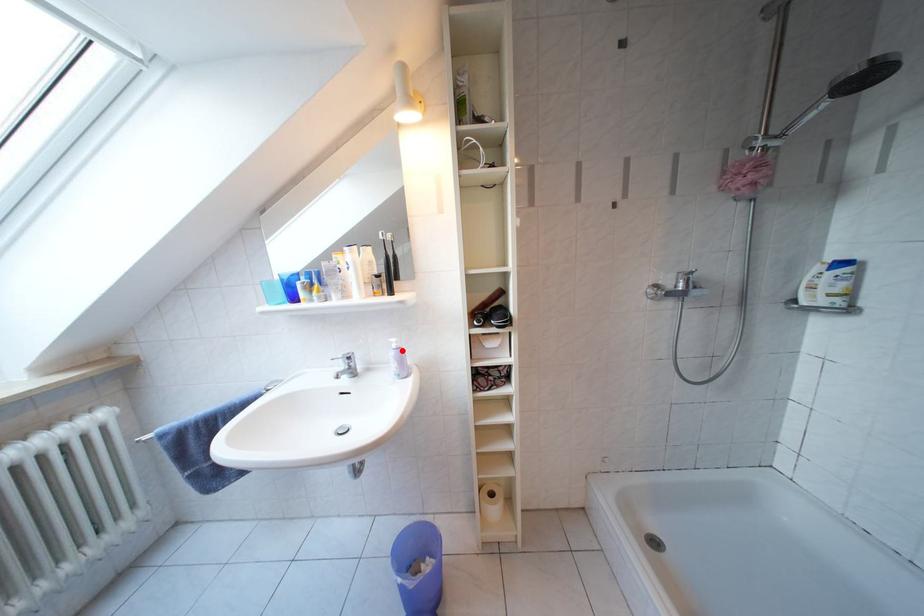
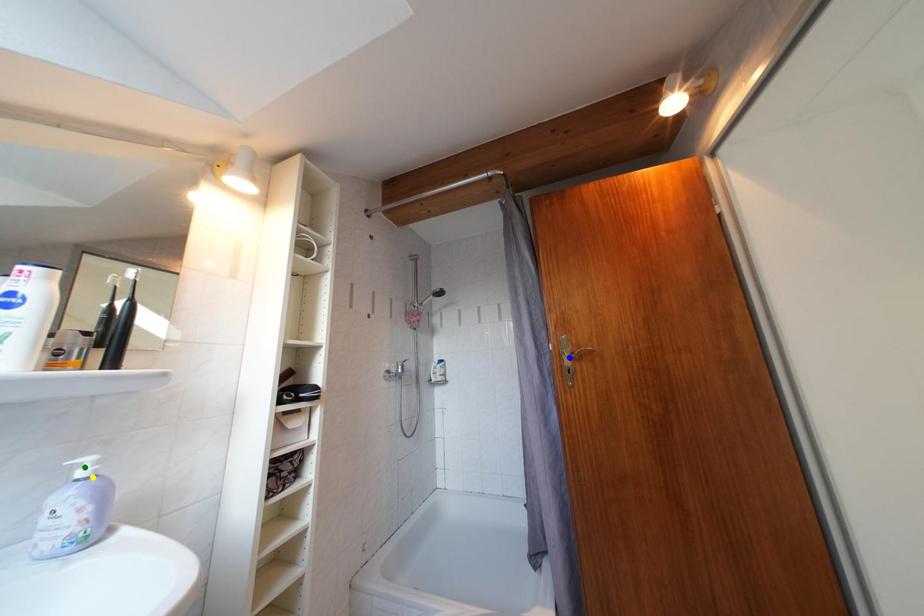
Question: I am providing you with two images of the same scene from different viewpoints. A red point is marked on the first image. You are given multiple points on the second image. Which point in image 2 represents the same 3d spot as the red point in image 1?

Choices:
 (A) yellow point
 (B) green point
 (C) blue point

Answer: (A)